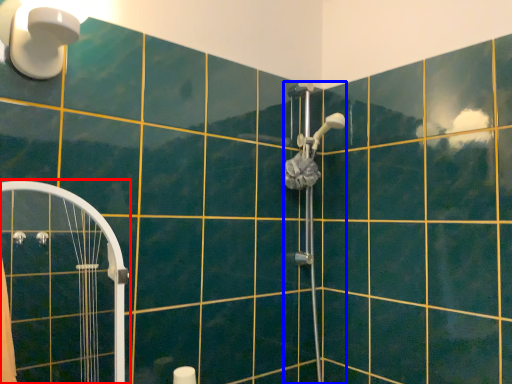
Question: Which point is closer to the camera, shower door (highlighted by a red box) or shower (highlighted by a blue box)?

Choices:
 (A) shower door
 (B) shower

Answer: (A)